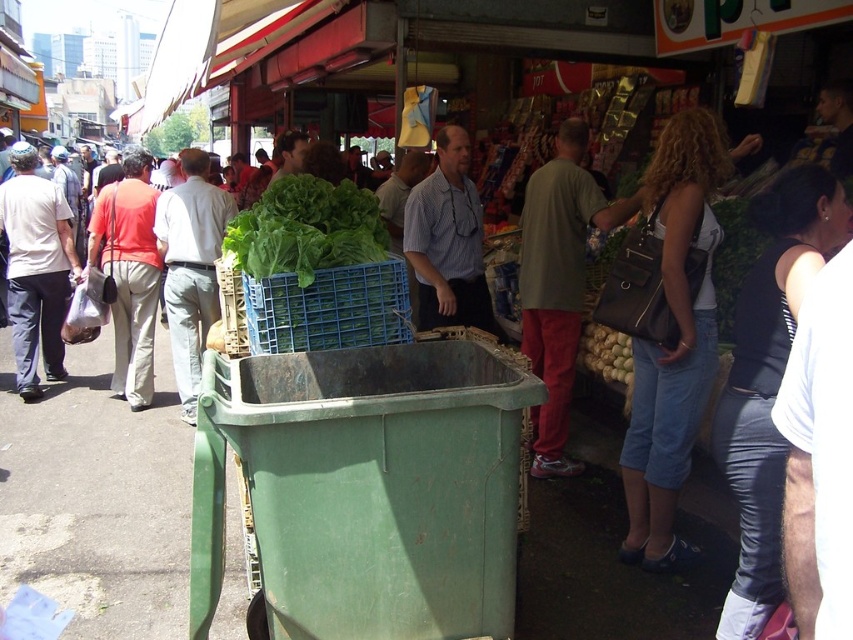
What is located at the coordinates point (306, 228) in the image?

The point (306, 228) indicates green leafy lettuce at center.